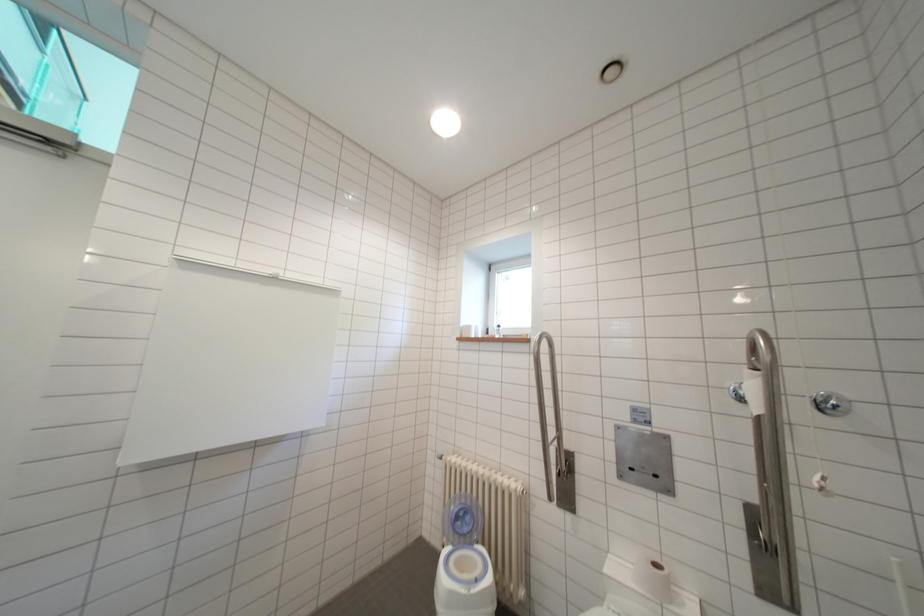
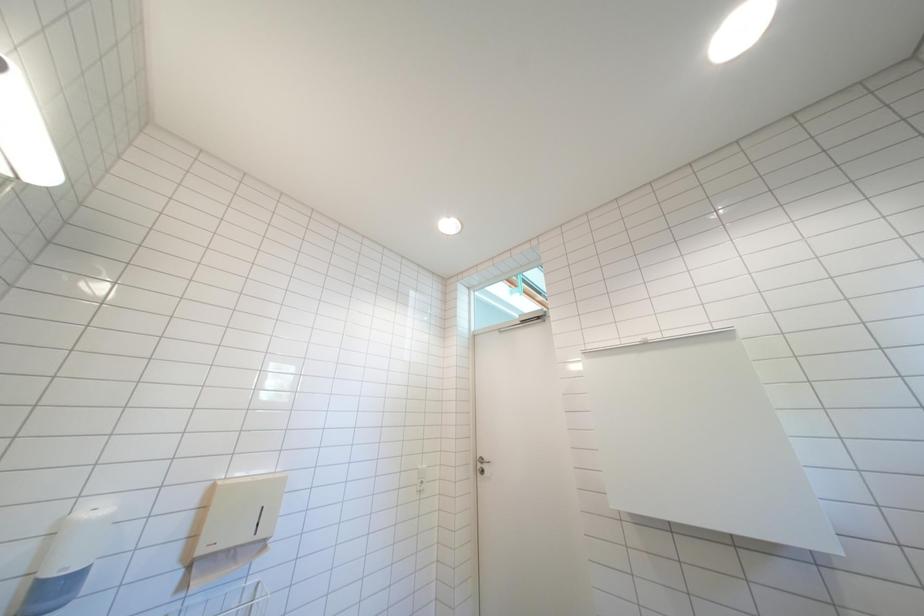
How did the camera likely rotate?

The rotation direction of the camera is left-up.